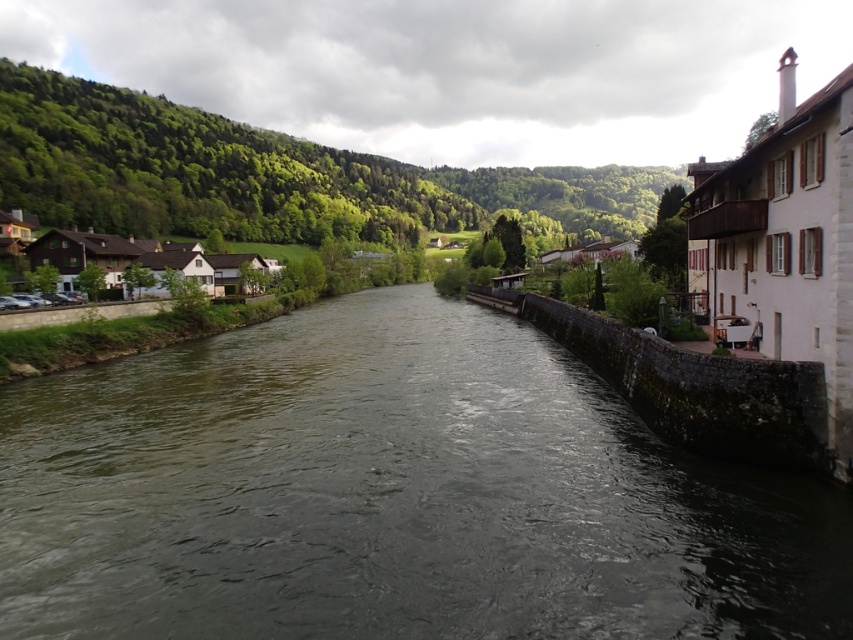
Does dark gray concrete stream at center have a lesser height compared to white stone houses at left?

Yes, dark gray concrete stream at center is shorter than white stone houses at left.

Does point (653, 524) come behind point (73, 285)?

No.

The image size is (853, 640). What are the coordinates of `dark gray concrete stream at center` in the screenshot? It's located at (392, 493).